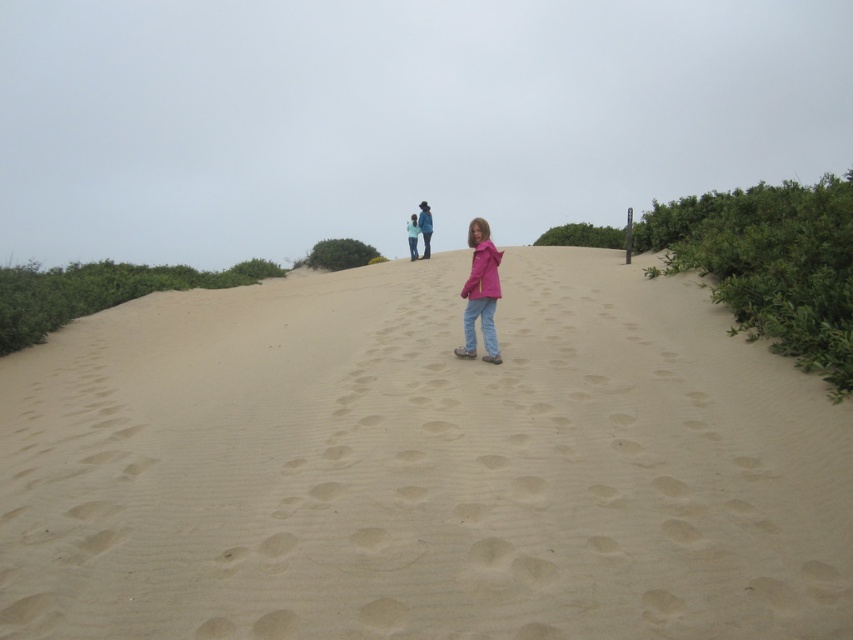
Question: Where is smooth sand at center located in relation to matte pink jacket at center in the image?

Choices:
 (A) right
 (B) left

Answer: (B)

Question: Can you confirm if matte pink jacket at center is wider than blue denim jacket at center?

Choices:
 (A) yes
 (B) no

Answer: (A)

Question: Which point is closer to the camera?

Choices:
 (A) (457, 352)
 (B) (416, 225)
 (C) (422, 218)

Answer: (A)

Question: Which point is closer to the camera taking this photo?

Choices:
 (A) (425, 230)
 (B) (412, 227)
 (C) (465, 282)

Answer: (C)

Question: Based on their relative distances, which object is nearer to the matte pink jacket at center?

Choices:
 (A) blue denim jacket at center
 (B) smooth sand at center

Answer: (B)

Question: Is smooth sand at center thinner than blue fabric jacket at upper center?

Choices:
 (A) no
 (B) yes

Answer: (A)